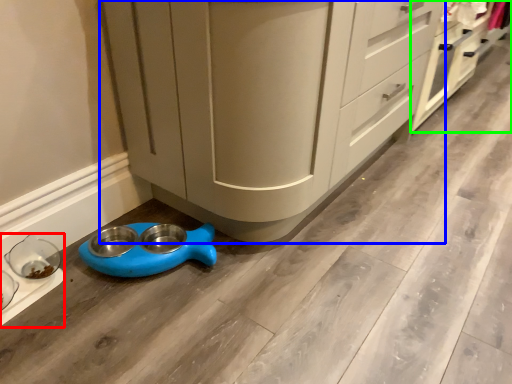
Question: Which object is positioned closest to appliance (highlighted by a red box)? Select from cabinetry (highlighted by a blue box) and cabinetry (highlighted by a green box).

Choices:
 (A) cabinetry
 (B) cabinetry

Answer: (A)